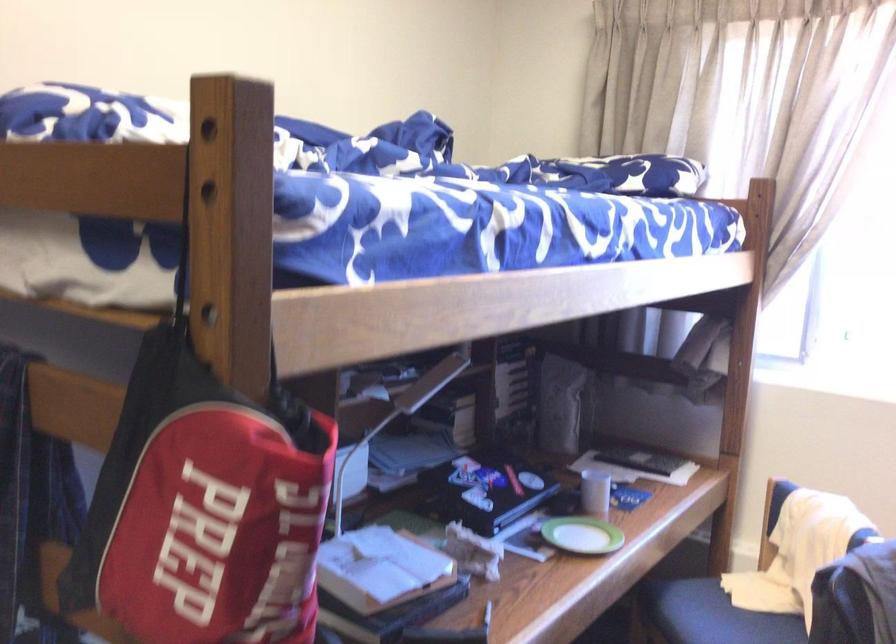
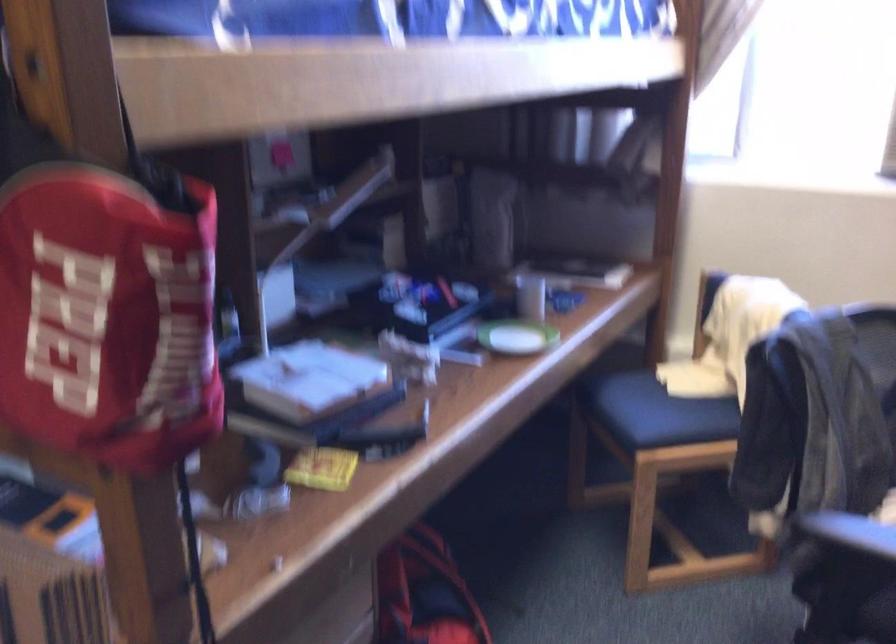
Where in the second image is the point corresponding to pixel 581 534 from the first image?

(515, 337)